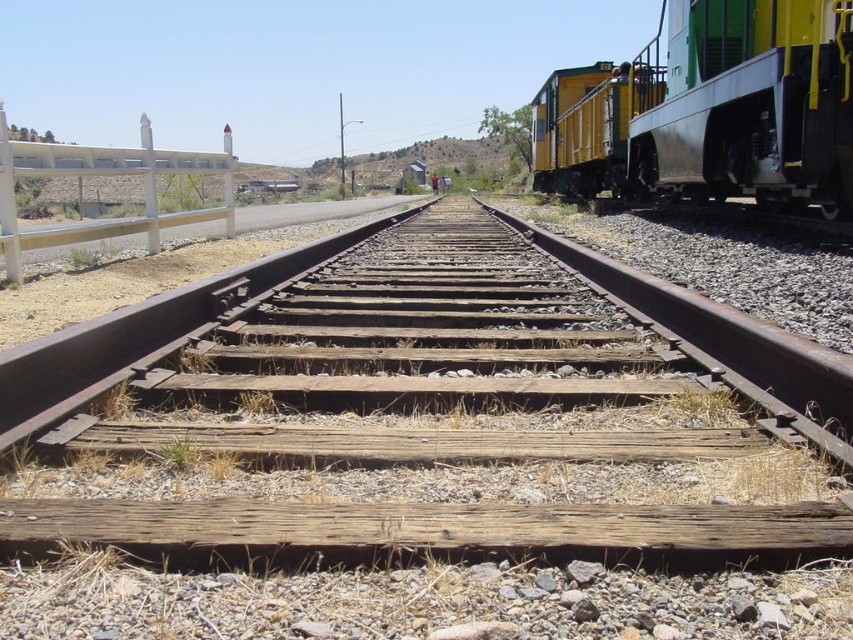
Question: Which point is farther from the camera taking this photo?

Choices:
 (A) (631, 196)
 (B) (15, 211)
 (C) (554, 120)
 (D) (178, 358)

Answer: (C)

Question: Is wooden at center to the right of yellow matte train car at right from the viewer's perspective?

Choices:
 (A) no
 (B) yes

Answer: (A)

Question: Which point is closer to the camera?

Choices:
 (A) wooden at center
 (B) white concrete fence at left
 (C) yellow matte train car at right

Answer: (B)

Question: Which point is closer to the camera?

Choices:
 (A) white concrete fence at left
 (B) yellow matte train car at right

Answer: (A)

Question: Can you confirm if green/yellow painted metal train car at right is wider than yellow matte train car at right?

Choices:
 (A) yes
 (B) no

Answer: (B)

Question: From the image, what is the correct spatial relationship of green/yellow painted metal train car at right in relation to white concrete fence at left?

Choices:
 (A) left
 (B) right

Answer: (B)